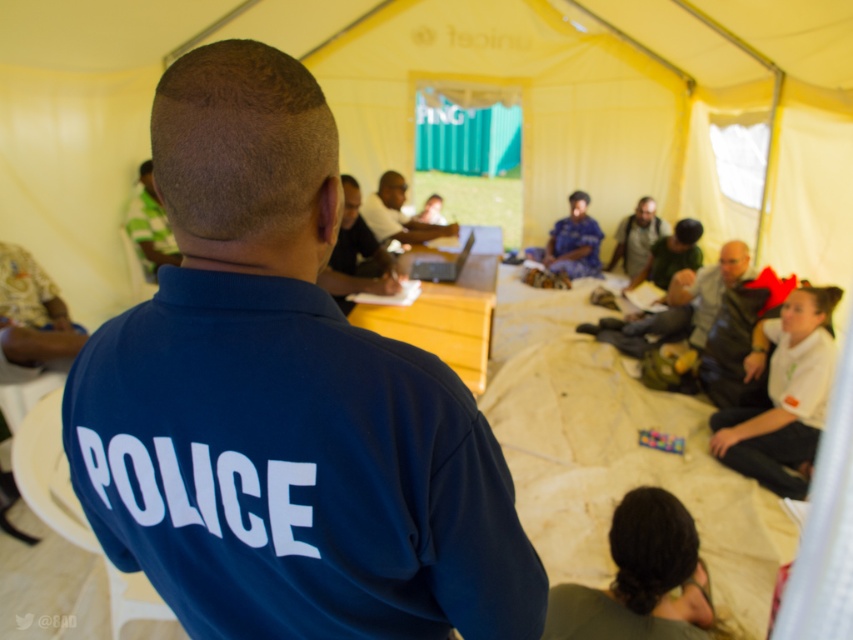
Looking at this image, between matte black shirt at center and green fabric shirt at upper left, which one appears on the right side from the viewer's perspective?

matte black shirt at center is more to the right.

Is point (357, 218) closer to camera compared to point (141, 209)?

Yes, it is.

You are a GUI agent. You are given a task and a screenshot of the screen. Output one action in this format:
    pyautogui.click(x=<x>, y=<y>)
    Task: Click on the matte black shirt at center
    
    Given the screenshot: What is the action you would take?
    pyautogui.click(x=355, y=256)

Can you confirm if matte black shirt at center is smaller than matte black laptop at center?

Actually, matte black shirt at center might be larger than matte black laptop at center.

Does point (346, 184) come closer to viewer compared to point (379, 200)?

Yes, point (346, 184) is in front of point (379, 200).

This screenshot has height=640, width=853. What do you see at coordinates (355, 256) in the screenshot?
I see `matte black shirt at center` at bounding box center [355, 256].

The width and height of the screenshot is (853, 640). In order to click on matte black shirt at center in this screenshot , I will do `click(355, 256)`.

Is gray fabric shirt at center to the right of silver metallic laptop at center from the viewer's perspective?

Indeed, gray fabric shirt at center is positioned on the right side of silver metallic laptop at center.

Is the position of gray fabric shirt at center less distant than that of silver metallic laptop at center?

No, it is behind silver metallic laptop at center.

Image resolution: width=853 pixels, height=640 pixels. What do you see at coordinates (637, 237) in the screenshot? I see `gray fabric shirt at center` at bounding box center [637, 237].

Image resolution: width=853 pixels, height=640 pixels. In order to click on gray fabric shirt at center in this screenshot , I will do `click(637, 237)`.